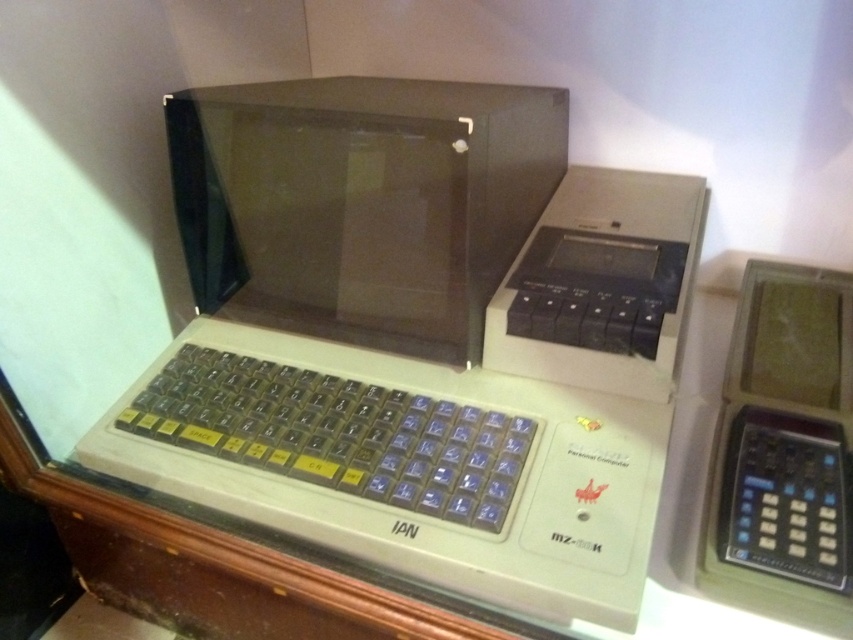
How much distance is there between white plastic computer at center and black plastic calculator at right?

white plastic computer at center and black plastic calculator at right are 11.64 inches apart.

Does white plastic computer at center have a larger size compared to black plastic calculator at right?

Correct, white plastic computer at center is larger in size than black plastic calculator at right.

What do you see at coordinates (419, 337) in the screenshot? I see `white plastic computer at center` at bounding box center [419, 337].

Locate an element on the screen. white plastic computer at center is located at coordinates (419, 337).

Is green plastic calculator at right closer to camera compared to clear plastic keyboard at center?

Yes, green plastic calculator at right is in front of clear plastic keyboard at center.

Who is taller, green plastic calculator at right or clear plastic keyboard at center?

Standing taller between the two is green plastic calculator at right.

The width and height of the screenshot is (853, 640). Identify the location of green plastic calculator at right. (784, 451).

Who is positioned more to the left, clear plastic keyboard at center or black plastic calculator at right?

Positioned to the left is clear plastic keyboard at center.

In the scene shown: Does clear plastic keyboard at center appear under black plastic calculator at right?

No.

What are the coordinates of `clear plastic keyboard at center` in the screenshot? It's located at (338, 433).

The image size is (853, 640). Find the location of `clear plastic keyboard at center`. clear plastic keyboard at center is located at coordinates (338, 433).